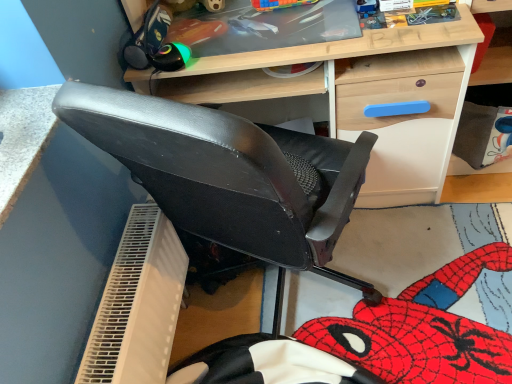
Question: From the image's perspective, is light wood desk at center above or below white textured table at upper left?

Choices:
 (A) above
 (B) below

Answer: (A)

Question: Does point (265, 56) appear closer or farther from the camera than point (3, 165)?

Choices:
 (A) farther
 (B) closer

Answer: (A)

Question: From a real-world perspective, is light wood desk at center positioned above or below white textured table at upper left?

Choices:
 (A) below
 (B) above

Answer: (A)

Question: Considering the positions of white textured table at upper left and light wood desk at center in the image, is white textured table at upper left taller or shorter than light wood desk at center?

Choices:
 (A) tall
 (B) short

Answer: (B)

Question: Does point (44, 107) appear closer or farther from the camera than point (308, 59)?

Choices:
 (A) farther
 (B) closer

Answer: (B)

Question: In terms of width, does white textured table at upper left look wider or thinner when compared to light wood desk at center?

Choices:
 (A) thin
 (B) wide

Answer: (A)

Question: Considering the positions of white textured table at upper left and light wood desk at center in the image, is white textured table at upper left bigger or smaller than light wood desk at center?

Choices:
 (A) big
 (B) small

Answer: (B)